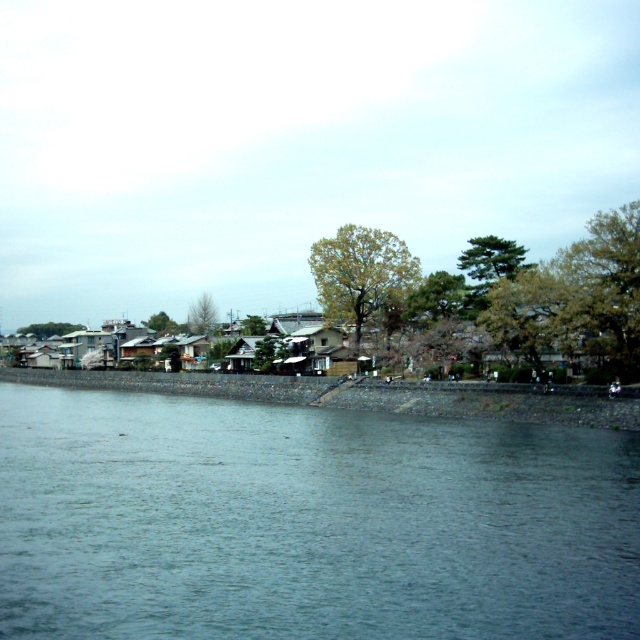
Question: Does blue water at center appear on the left side of smooth concrete shoreline at lower center?

Choices:
 (A) no
 (B) yes

Answer: (A)

Question: Which of the following is the farthest from the observer?

Choices:
 (A) blue water at center
 (B) smooth concrete shoreline at lower center

Answer: (B)

Question: Does blue water at center appear over smooth concrete shoreline at lower center?

Choices:
 (A) no
 (B) yes

Answer: (B)

Question: Which of the following is the closest to the observer?

Choices:
 (A) (420, 392)
 (B) (35, 602)

Answer: (B)

Question: Does blue water at center appear on the left side of smooth concrete shoreline at lower center?

Choices:
 (A) yes
 (B) no

Answer: (B)